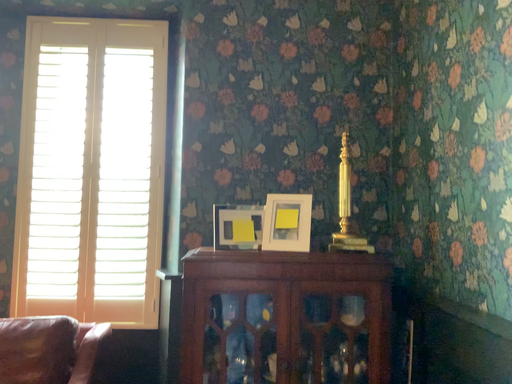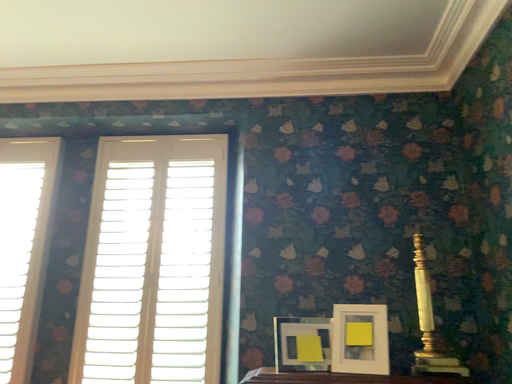
Question: How did the camera likely rotate when shooting the video?

Choices:
 (A) rotated downward
 (B) rotated upward

Answer: (B)